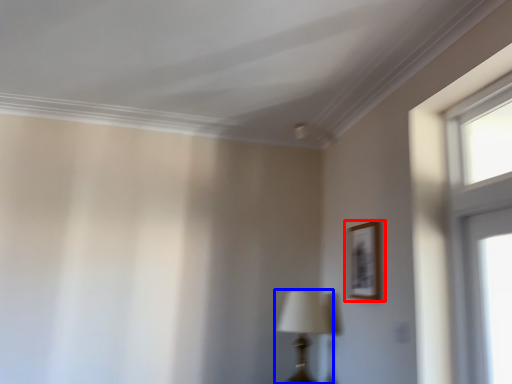
Question: Which point is closer to the camera, picture frame (highlighted by a red box) or table lamp (highlighted by a blue box)?

Choices:
 (A) picture frame
 (B) table lamp

Answer: (A)